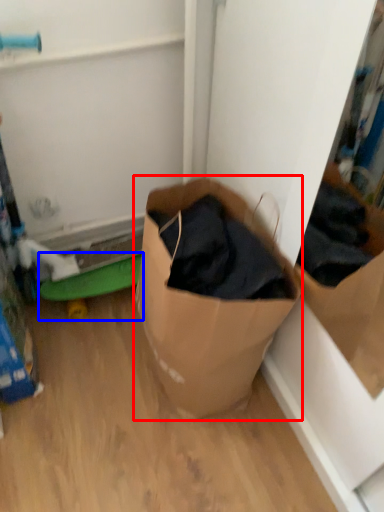
Question: Which of the following is the farthest to the observer, box (highlighted by a red box) or toy (highlighted by a blue box)?

Choices:
 (A) box
 (B) toy

Answer: (B)